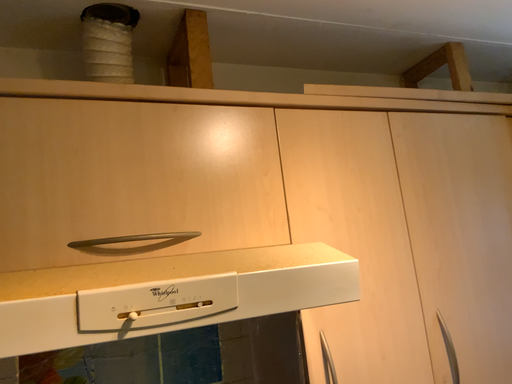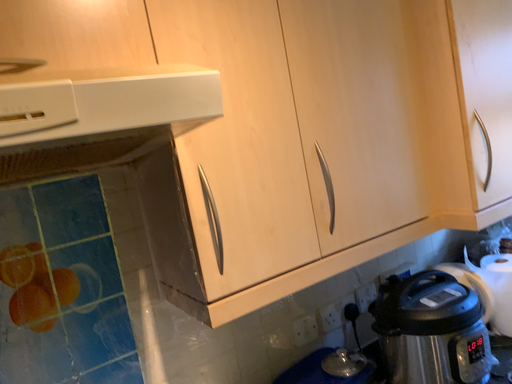
Question: How did the camera likely rotate when shooting the video?

Choices:
 (A) rotated upward
 (B) rotated downward

Answer: (B)